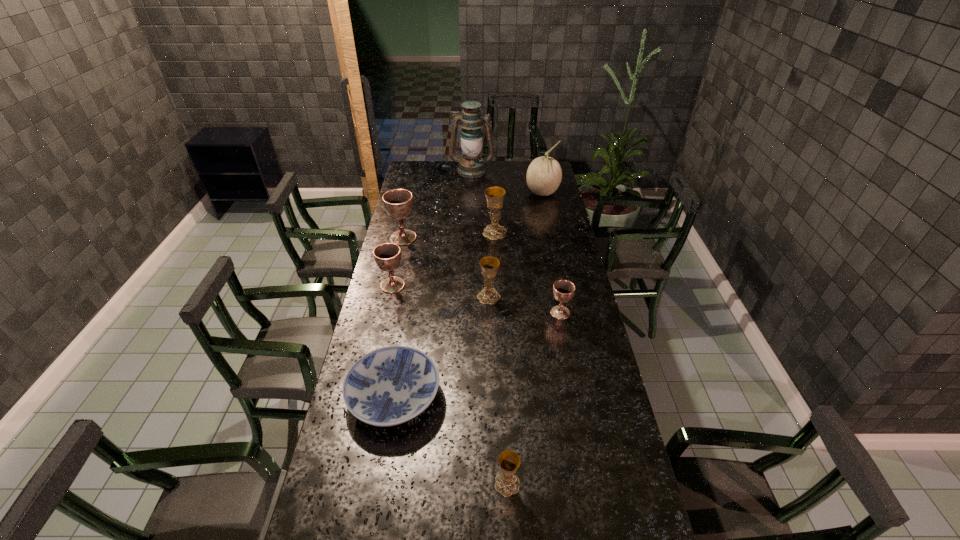
Locate an element on the screen. The width and height of the screenshot is (960, 540). the nearest gold chalice is located at coordinates (507, 483).

Where is `the nearest chalice`? the nearest chalice is located at coordinates (507, 483).

What are the coordinates of `blue plate` in the screenshot? It's located at (388, 386).

You are a GUI agent. You are given a task and a screenshot of the screen. Output one action in this format:
    pyautogui.click(x=<x>, y=<y>)
    Task: Click on the second nearest object
    
    Given the screenshot: What is the action you would take?
    pyautogui.click(x=388, y=386)

At what (x,y) coordinates should I click in order to perform the action: click on free location located on the left of the oil lamp. Please return your answer as a coordinate pair (x, y). This screenshot has width=960, height=540. Looking at the image, I should click on (431, 170).

At what (x,y) coordinates should I click in order to perform the action: click on vacant space located on the front of the second tallest object. Please return your answer as a coordinate pair (x, y). The height and width of the screenshot is (540, 960). Looking at the image, I should click on (552, 239).

Identify the location of vacant area situated on the left of the farthest gold chalice. The height and width of the screenshot is (540, 960). (401, 233).

Where is `free location located 0.340m on the front of the biggest brown chalice`? free location located 0.340m on the front of the biggest brown chalice is located at coordinates (390, 298).

Locate an element on the screen. This screenshot has width=960, height=540. vacant space located on the left of the second nearest gold chalice is located at coordinates (412, 296).

Locate an element on the screen. The height and width of the screenshot is (540, 960). free point located on the right of the second smallest brown chalice is located at coordinates (461, 285).